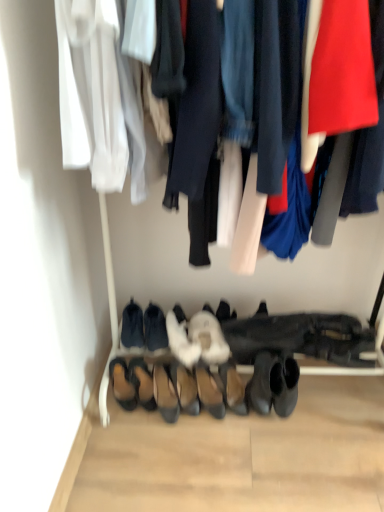
Question: Would you say white fuzzy slippers at center, which ranks as the fourth footwear in right-to-left order, is inside or outside white fluffy slippers at center, which is the 6th footwear from left to right?

Choices:
 (A) outside
 (B) inside

Answer: (A)

Question: From the image's perspective, is white fuzzy slippers at center, which ranks as the fourth footwear in right-to-left order, positioned above or below white fluffy slippers at center, which is the 6th footwear from left to right?

Choices:
 (A) above
 (B) below

Answer: (B)

Question: Which of these objects is positioned closest to the white fluffy slipper at center, placed as the ninth footwear when sorted from left to right?

Choices:
 (A) black suede shoes at lower center, the 2th footwear when ordered from left to right
 (B) black suede booties at center, marked as the fourth footwear in a left-to-right arrangement
 (C) black leather boot at lower center, the 1th footwear when ordered from right to left
 (D) brown suede sandals at lower left, placed as the 1th footwear when sorted from left to right
 (E) white fluffy slippers at center, the fifth footwear from the right

Answer: (E)

Question: Which object is the farthest from the white fuzzy slippers at center, which ranks as the fourth footwear in right-to-left order?

Choices:
 (A) black leather boot at lower center, the 1th footwear when ordered from right to left
 (B) leather shoes at center, positioned as the 3th footwear in right-to-left order
 (C) black suede shoes at lower center, the 2th footwear when ordered from left to right
 (D) suede black heels at center, which is counted as the fifth footwear, starting from the left
 (E) black suede booties at center, marked as the fourth footwear in a left-to-right arrangement

Answer: (C)